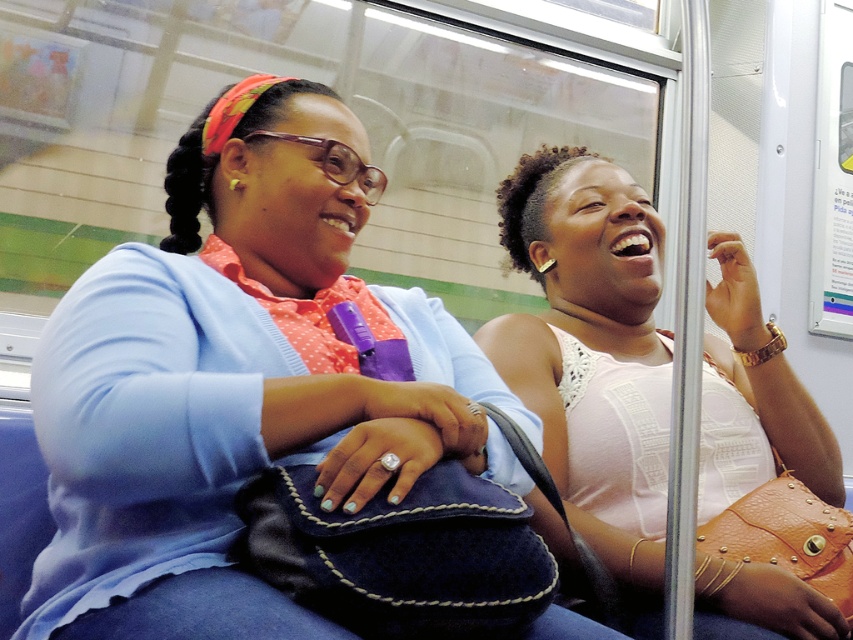
Please describe the exact position of the matte blue sweater at center in the image using coordinates.

The matte blue sweater at center is located at coordinates point (238, 381).

You are a photographer taking a picture of the two women in the scene. You notice the matte blue sweater at center and the pink lace top at right. Which clothing item is covering part of the other?

The matte blue sweater at center is positioned over the pink lace top at right, so it is covering part of it.